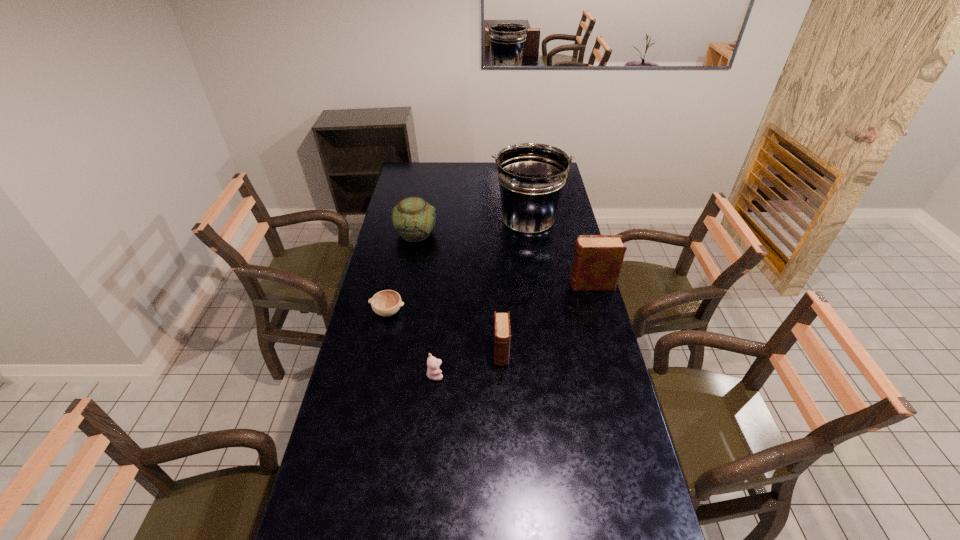
The height and width of the screenshot is (540, 960). What are the coordinates of `free spot that satisfies the following two spatial constraints: 1. on the spine side of the farther diary; 2. on the front side of the bowl` in the screenshot? It's located at (598, 312).

Locate an element on the screen. blank space that satisfies the following two spatial constraints: 1. on the back side of the bucket; 2. on the right side of the third nearest object is located at coordinates (407, 223).

The width and height of the screenshot is (960, 540). I want to click on free space that satisfies the following two spatial constraints: 1. on the spine side of the second nearest object; 2. at the face of the fourth object from right to left, so click(x=502, y=374).

Identify the location of vacant region that satisfies the following two spatial constraints: 1. on the back side of the shortest object; 2. on the left side of the pottery. This screenshot has height=540, width=960. (405, 233).